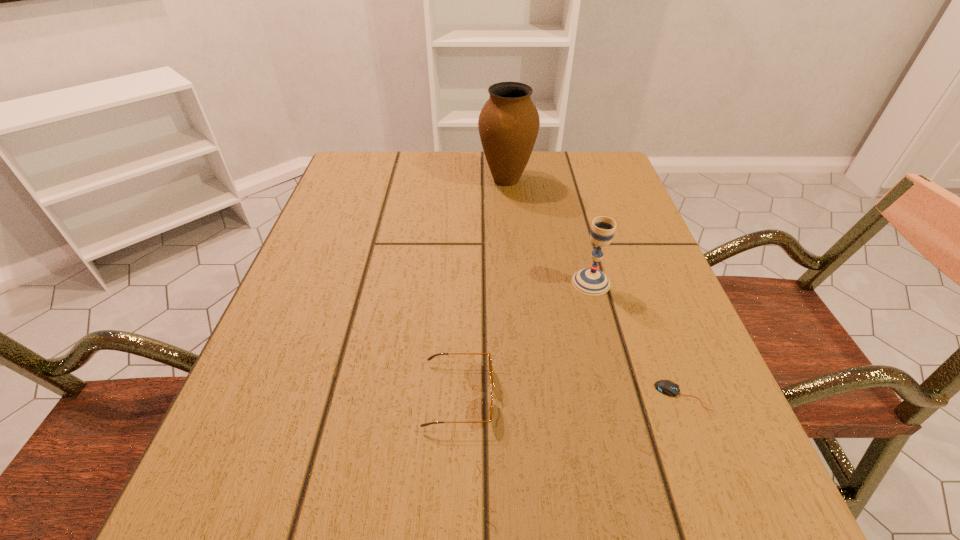
Locate an element on the screen. free space between the second farthest object and the rightmost object is located at coordinates (636, 339).

The width and height of the screenshot is (960, 540). What are the coordinates of `free space between the urn and the second farthest object` in the screenshot? It's located at (549, 231).

The image size is (960, 540). What are the coordinates of `vacant space that's between the rightmost object and the third tallest object` in the screenshot? It's located at (570, 395).

Find the location of a particular element. vacant area that lies between the rightmost object and the third object from left to right is located at coordinates (636, 339).

The height and width of the screenshot is (540, 960). Find the location of `empty space that is in between the third object from left to right and the shortest object`. empty space that is in between the third object from left to right and the shortest object is located at coordinates (636, 339).

Locate an element on the screen. This screenshot has width=960, height=540. vacant space in between the mouse and the sunglasses is located at coordinates (570, 395).

At what (x,y) coordinates should I click in order to perform the action: click on vacant region between the third shortest object and the farthest object. Please return your answer as a coordinate pair (x, y). Looking at the image, I should click on (549, 231).

The height and width of the screenshot is (540, 960). I want to click on object that stands as the closest to the third shortest object, so click(x=667, y=387).

Locate which object is the closest to the chalice. Please provide its 2D coordinates. Your answer should be formatted as a tuple, i.e. [(x, y)], where the tuple contains the x and y coordinates of a point satisfying the conditions above.

[(667, 387)]

Image resolution: width=960 pixels, height=540 pixels. I want to click on free spot that satisfies the following two spatial constraints: 1. on the lenses of the sunglasses; 2. on the left side of the shortest object, so click(x=459, y=396).